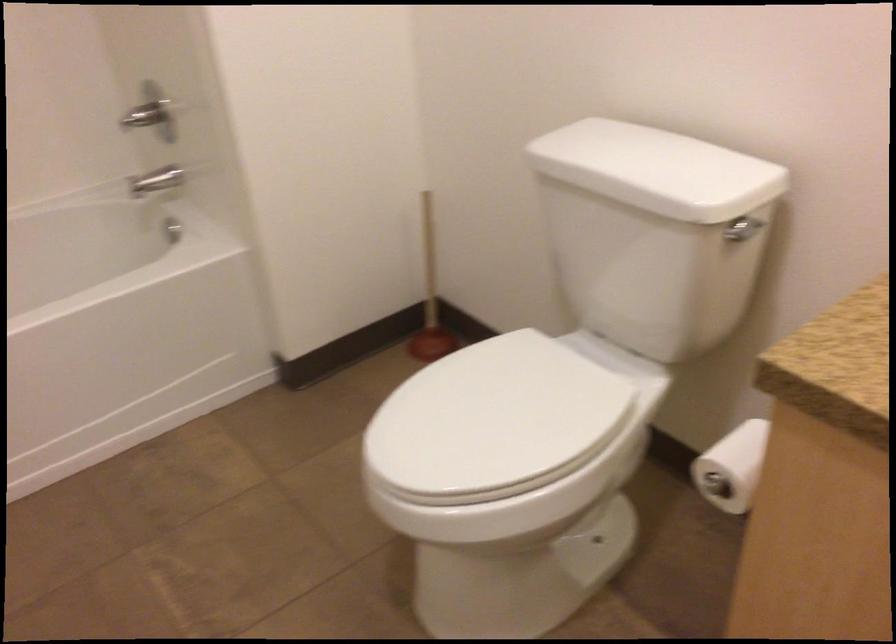
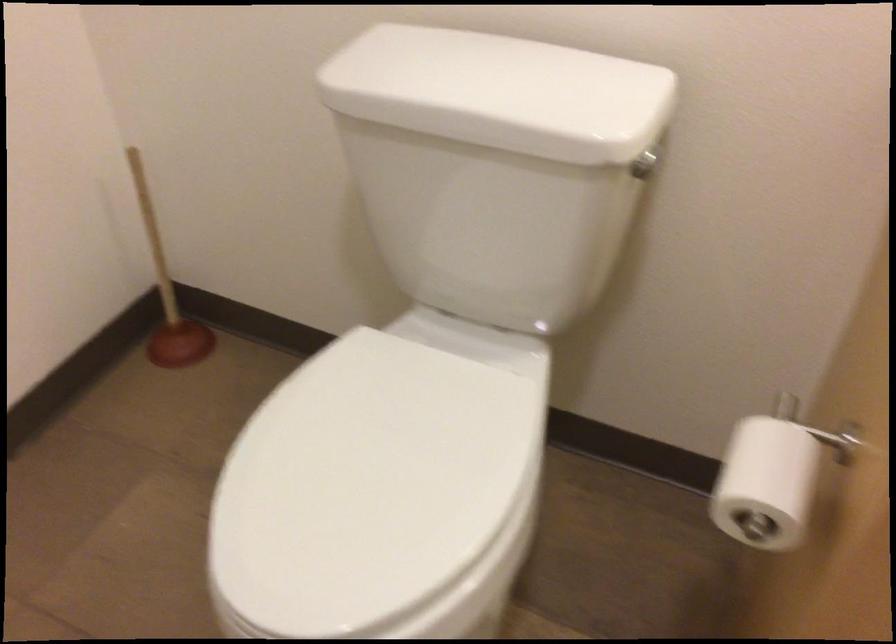
The point at (778, 243) is marked in the first image. Where is the corresponding point in the second image?

(643, 165)